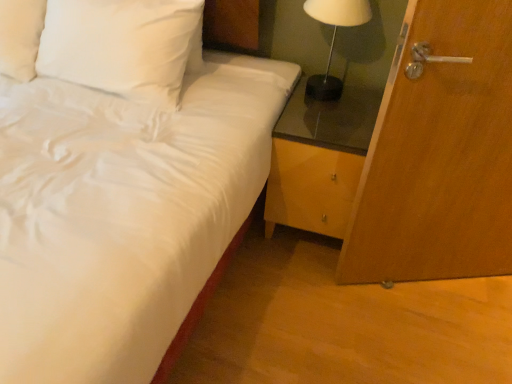
Question: From a real-world perspective, is white satin pillow at upper left physically below white satin bed at center?

Choices:
 (A) no
 (B) yes

Answer: (A)

Question: Is white satin pillow at upper left smaller than white satin bed at center?

Choices:
 (A) no
 (B) yes

Answer: (B)

Question: Is white satin bed at center a part of white satin pillow at upper left?

Choices:
 (A) no
 (B) yes

Answer: (A)

Question: Is white satin pillow at upper left touching white satin bed at center?

Choices:
 (A) yes
 (B) no

Answer: (B)

Question: Is white satin pillow at upper left to the left of white satin bed at center from the viewer's perspective?

Choices:
 (A) yes
 (B) no

Answer: (B)

Question: From the image's perspective, is white glossy table lamp at upper right above or below white satin bed at center?

Choices:
 (A) below
 (B) above

Answer: (B)

Question: Is white glossy table lamp at upper right to the left or to the right of white satin bed at center in the image?

Choices:
 (A) right
 (B) left

Answer: (A)

Question: Looking at their shapes, would you say white glossy table lamp at upper right is wider or thinner than white satin bed at center?

Choices:
 (A) wide
 (B) thin

Answer: (B)

Question: Is white glossy table lamp at upper right spatially inside white satin bed at center, or outside of it?

Choices:
 (A) inside
 (B) outside

Answer: (B)

Question: From the image's perspective, is white satin pillow at upper left positioned above or below white glossy table lamp at upper right?

Choices:
 (A) above
 (B) below

Answer: (B)

Question: Considering the positions of white satin pillow at upper left and white glossy table lamp at upper right in the image, is white satin pillow at upper left bigger or smaller than white glossy table lamp at upper right?

Choices:
 (A) big
 (B) small

Answer: (A)

Question: From a real-world perspective, is white satin pillow at upper left positioned above or below white glossy table lamp at upper right?

Choices:
 (A) above
 (B) below

Answer: (B)

Question: Considering the positions of point (82, 23) and point (362, 19), is point (82, 23) closer or farther from the camera than point (362, 19)?

Choices:
 (A) closer
 (B) farther

Answer: (A)

Question: From the image's perspective, is white satin pillow at upper left positioned above or below wooden door at right?

Choices:
 (A) below
 (B) above

Answer: (B)

Question: Is white satin pillow at upper left inside the boundaries of wooden door at right, or outside?

Choices:
 (A) inside
 (B) outside

Answer: (B)